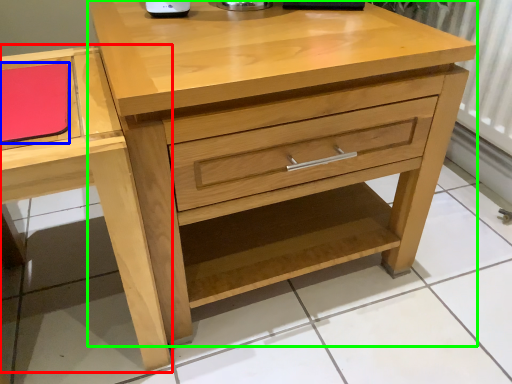
Question: Estimate the real-world distances between objects in this image. Which object is closer to vanity (highlighted by a red box), notepad (highlighted by a blue box) or chest of drawers (highlighted by a green box)?

Choices:
 (A) notepad
 (B) chest of drawers

Answer: (A)